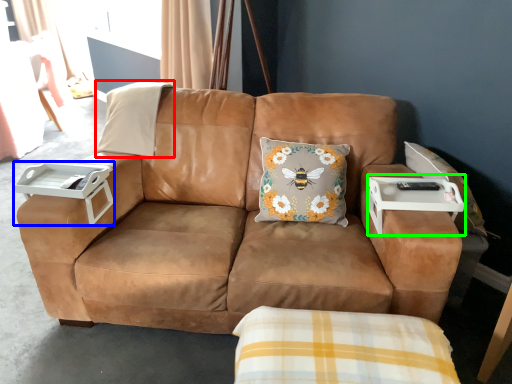
Question: Considering the real-world distances, which object is farthest from pillow (highlighted by a red box)? table (highlighted by a blue box) or table (highlighted by a green box)?

Choices:
 (A) table
 (B) table

Answer: (B)